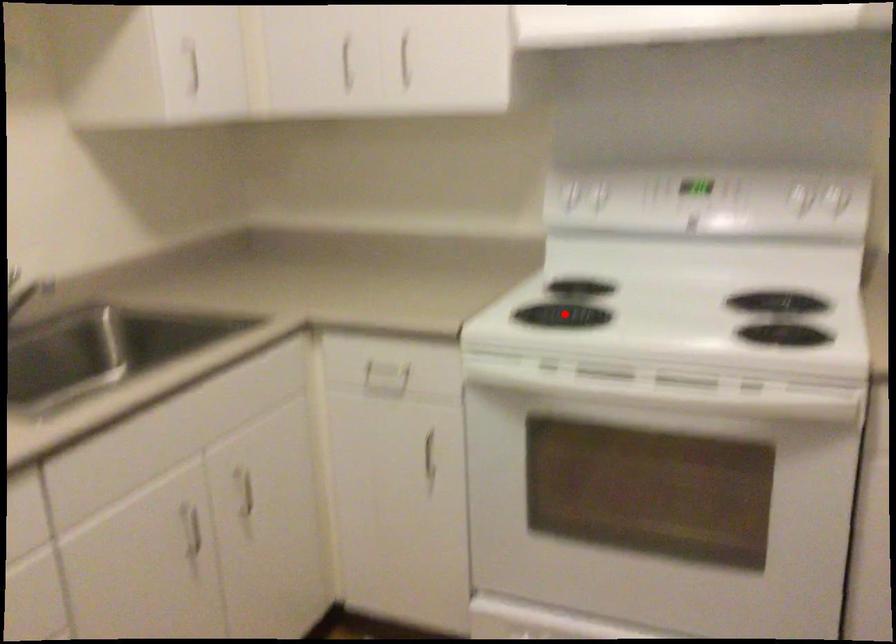
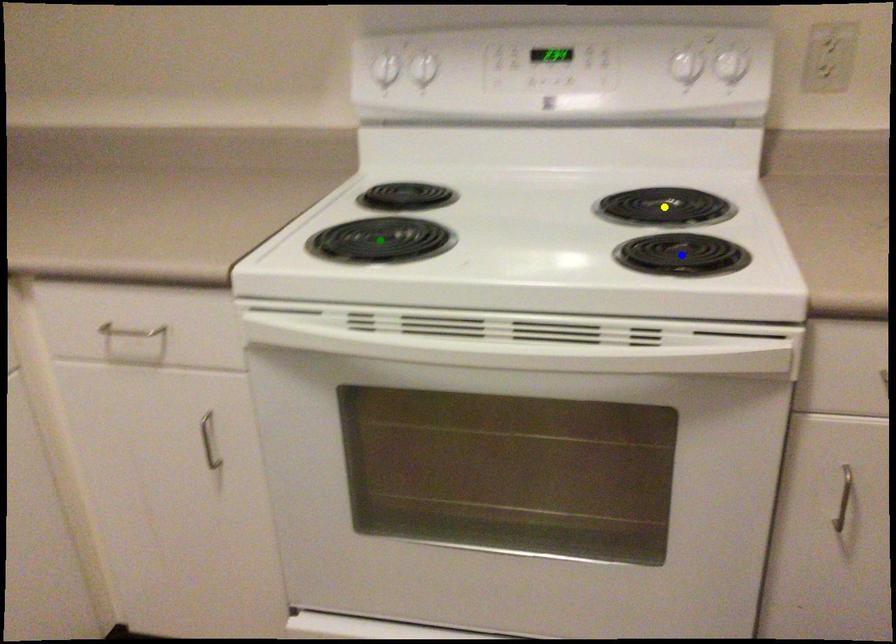
Question: I am providing you with two images of the same scene from different viewpoints. A red point is marked on the first image. You are given multiple points on the second image. Can you choose the point in image 2 that corresponds to the point in image 1?

Choices:
 (A) yellow point
 (B) green point
 (C) blue point

Answer: (B)